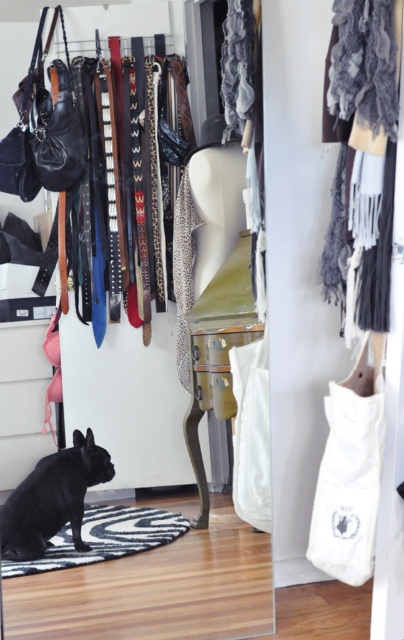
Is black matte dog at lower left to the right of zebra-patterned rug at lower left from the viewer's perspective?

In fact, black matte dog at lower left is to the left of zebra-patterned rug at lower left.

Find the location of a particular element. This screenshot has width=404, height=640. black matte dog at lower left is located at coordinates (52, 499).

Can you confirm if black matte dog at lower left is positioned above white fabric bag at center?

No, black matte dog at lower left is not above white fabric bag at center.

Who is more forward, (x=75, y=456) or (x=248, y=365)?

Point (x=75, y=456) is in front.

Locate an element on the screen. This screenshot has height=640, width=404. black matte dog at lower left is located at coordinates (52, 499).

Does white fabric bag at center appear over zebra-patterned rug at lower left?

Yes.

Is white fabric bag at center thinner than zebra-patterned rug at lower left?

Yes, white fabric bag at center is thinner than zebra-patterned rug at lower left.

Is point (250, 397) behind point (119, 545)?

Yes, it is behind point (119, 545).

Locate an element on the screen. The image size is (404, 640). white fabric bag at center is located at coordinates (252, 435).